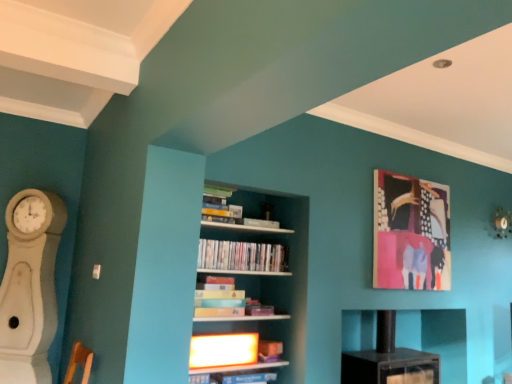
Question: In the image, is white wood fireplace at left positioned in front of or behind white wooden bookcase at center?

Choices:
 (A) behind
 (B) front

Answer: (A)

Question: From their relative heights in the image, would you say white wood fireplace at left is taller or shorter than white wooden bookcase at center?

Choices:
 (A) short
 (B) tall

Answer: (B)

Question: Which is nearer to the matte black shelf at center, which ranks as the 1th shelf in back-to-front order?

Choices:
 (A) matte plastic book at center, the 1th book positioned from the bottom
 (B) matte white shelf at center, marked as the 1th shelf in a front-to-back arrangement
 (C) matte green book at upper center, marked as the 1th book in a top-to-bottom arrangement
 (D) abstract painting at upper right
 (E) white wood fireplace at left

Answer: (D)

Question: Which is farther from the matte white shelf at center, acting as the second shelf starting from the back?

Choices:
 (A) matte green book at upper center, marked as the 1th book in a top-to-bottom arrangement
 (B) abstract painting at upper right
 (C) matte cardboard book at center, arranged as the third book when viewed from the top
 (D) matte plastic book at center, the 1th book positioned from the bottom
 (E) white wood fireplace at left

Answer: (E)